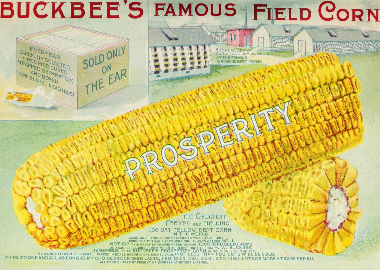
You are a GUI agent. You are given a task and a screenshot of the screen. Output one action in this format:
    pyautogui.click(x=<x>, y=<y>)
    Task: Click on the doors
    This screenshot has height=270, width=380.
    Given the screenshot: What is the action you would take?
    pyautogui.click(x=301, y=45), pyautogui.click(x=260, y=41), pyautogui.click(x=246, y=40)